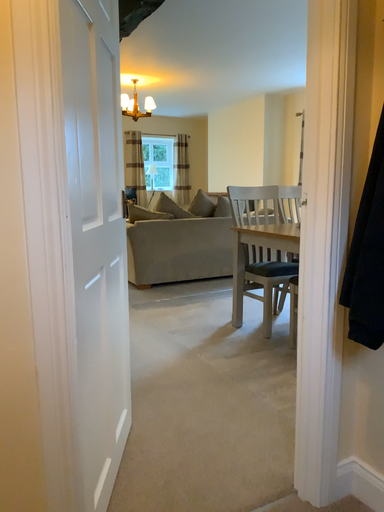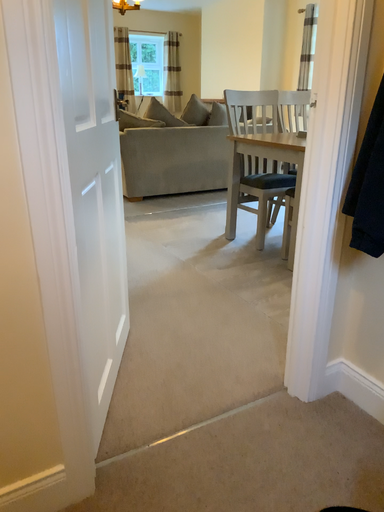
Question: Which way did the camera rotate in the video?

Choices:
 (A) rotated downward
 (B) rotated upward

Answer: (A)